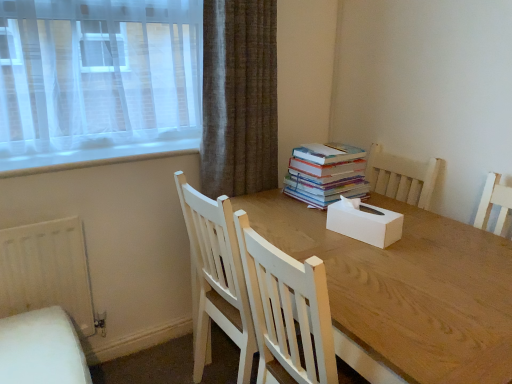
Where is `white cardboard tissue box at center`? Image resolution: width=512 pixels, height=384 pixels. white cardboard tissue box at center is located at coordinates (365, 222).

Describe the element at coordinates (326, 174) in the screenshot. I see `multicolored paper book at center` at that location.

What is the approximate width of white matte radiator at lower left?

white matte radiator at lower left is 2.34 inches wide.

What do you see at coordinates (47, 271) in the screenshot? I see `white matte radiator at lower left` at bounding box center [47, 271].

Where is `white cardboard tissue box at center`? The image size is (512, 384). white cardboard tissue box at center is located at coordinates (365, 222).

In the image, is multicolored paper book at center positioned in front of or behind wooden table at center?

multicolored paper book at center is positioned farther from the viewer than wooden table at center.

Can you confirm if multicolored paper book at center is bigger than wooden table at center?

Actually, multicolored paper book at center might be smaller than wooden table at center.

From a real-world perspective, who is located higher, multicolored paper book at center or wooden table at center?

multicolored paper book at center.

In the scene shown: Is multicolored paper book at center looking in the opposite direction of wooden table at center?

No, multicolored paper book at center is not facing the opposite direction of wooden table at center.

In the scene shown: Considering the relative sizes of white cardboard tissue box at center and multicolored paper book at center in the image provided, is white cardboard tissue box at center thinner than multicolored paper book at center?

Yes, white cardboard tissue box at center is thinner than multicolored paper book at center.

Which object is closer to the camera, white cardboard tissue box at center or multicolored paper book at center?

white cardboard tissue box at center is closer to the camera.

From the image's perspective, who appears lower, white cardboard tissue box at center or multicolored paper book at center?

white cardboard tissue box at center, from the image's perspective.

Which object is wider, white matte radiator at lower left or white cardboard tissue box at center?

Wider between the two is white cardboard tissue box at center.

Is white matte radiator at lower left turned away from white cardboard tissue box at center?

No, white matte radiator at lower left is not facing the opposite direction of white cardboard tissue box at center.

Between white matte radiator at lower left and white cardboard tissue box at center, which one has more height?

Standing taller between the two is white matte radiator at lower left.

From the image's perspective, between white matte radiator at lower left and white cardboard tissue box at center, who is located below?

From the image's view, white matte radiator at lower left is below.

What's the angular difference between white cardboard tissue box at center and wooden table at center's facing directions?

The angular difference between white cardboard tissue box at center and wooden table at center is 7.06 degrees.

Where is `box behind the wooden table at center`? This screenshot has width=512, height=384. box behind the wooden table at center is located at coordinates (365, 222).

Considering the positions of point (327, 218) and point (430, 266), is point (327, 218) closer or farther from the camera than point (430, 266)?

Point (327, 218) appears to be farther away from the viewer than point (430, 266).

Locate an element on the screen. book above the wooden table at center (from the image's perspective) is located at coordinates (326, 174).

Based on the photo, from the image's perspective, which is below, wooden table at center or multicolored paper book at center?

From the image's view, wooden table at center is below.

From a real-world perspective, which object stands above the other?

multicolored paper book at center is physically above.

Consider the image. Which object is thinner, wooden table at center or multicolored paper book at center?

Thinner between the two is multicolored paper book at center.

Is white matte radiator at lower left far away from wooden table at center?

They are positioned close to each other.

Between point (80, 285) and point (398, 316), which one is positioned in front?

The point (398, 316) is more forward.

Based on the photo, from the image's perspective, which object appears higher, white matte radiator at lower left or wooden table at center?

white matte radiator at lower left appears higher in the image.

Would you say white matte radiator at lower left is to the left or to the right of wooden table at center in the picture?

In the image, white matte radiator at lower left appears on the left side of wooden table at center.

Considering the relative sizes of multicolored paper book at center and white matte radiator at lower left in the image provided, is multicolored paper book at center taller than white matte radiator at lower left?

No.

Is multicolored paper book at center inside or outside of white matte radiator at lower left?

multicolored paper book at center is spatially situated outside white matte radiator at lower left.

Is white matte radiator at lower left at the back of multicolored paper book at center?

multicolored paper book at center does not have its back to white matte radiator at lower left.

From the image's perspective, which one is positioned lower, multicolored paper book at center or white matte radiator at lower left?

white matte radiator at lower left appears lower in the image.

Where is `round table below the multicolored paper book at center (from the image's perspective)`? The width and height of the screenshot is (512, 384). round table below the multicolored paper book at center (from the image's perspective) is located at coordinates (406, 292).

You are a GUI agent. You are given a task and a screenshot of the screen. Output one action in this format:
    pyautogui.click(x=<x>, y=<y>)
    Task: Click on the book that is above the white cardboard tissue box at center (from a real-world perspective)
    The height and width of the screenshot is (384, 512).
    Given the screenshot: What is the action you would take?
    pyautogui.click(x=326, y=174)

Based on their spatial positions, is wooden table at center or white matte radiator at lower left closer to multicolored paper book at center?

Among the two, wooden table at center is located nearer to multicolored paper book at center.

From the image, which object appears to be farther from white cardboard tissue box at center, wooden table at center or white matte radiator at lower left?

white matte radiator at lower left lies further to white cardboard tissue box at center than the other object.

Looking at the image, which one is located closer to multicolored paper book at center, white cardboard tissue box at center or white matte radiator at lower left?

Based on the image, white cardboard tissue box at center appears to be nearer to multicolored paper book at center.

When comparing their distances from multicolored paper book at center, does white cardboard tissue box at center or wooden table at center seem further?

wooden table at center lies further to multicolored paper book at center than the other object.

Which object lies further to the anchor point white matte radiator at lower left, multicolored paper book at center or wooden table at center?

multicolored paper book at center.

Based on their spatial positions, is multicolored paper book at center or white matte radiator at lower left further from white cardboard tissue box at center?

The object further to white cardboard tissue box at center is white matte radiator at lower left.

Considering their positions, is white cardboard tissue box at center positioned further to white matte radiator at lower left than multicolored paper book at center?

white cardboard tissue box at center is positioned further to the anchor white matte radiator at lower left.

Estimate the real-world distances between objects in this image. Which object is further from white cardboard tissue box at center, white matte radiator at lower left or multicolored paper book at center?

The object further to white cardboard tissue box at center is white matte radiator at lower left.

Where is `box positioned between wooden table at center and multicolored paper book at center from near to far`? box positioned between wooden table at center and multicolored paper book at center from near to far is located at coordinates (365, 222).

Find the location of a particular element. The image size is (512, 384). book situated between white matte radiator at lower left and wooden table at center from left to right is located at coordinates (326, 174).

At what (x,y) coordinates should I click in order to perform the action: click on book between white matte radiator at lower left and white cardboard tissue box at center from left to right. Please return your answer as a coordinate pair (x, y). Looking at the image, I should click on (326, 174).

Where is `box located between white matte radiator at lower left and wooden table at center in the left-right direction`? This screenshot has width=512, height=384. box located between white matte radiator at lower left and wooden table at center in the left-right direction is located at coordinates (365, 222).